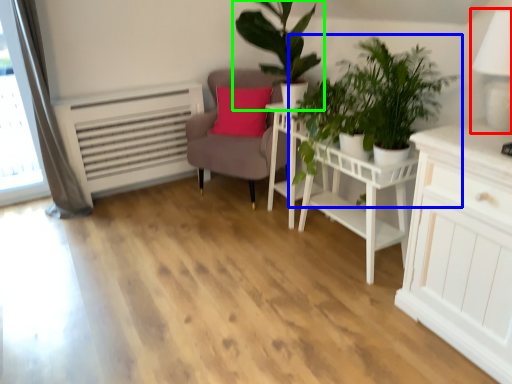
Question: Which is farther away from table lamp (highlighted by a red box)? houseplant (highlighted by a blue box) or houseplant (highlighted by a green box)?

Choices:
 (A) houseplant
 (B) houseplant

Answer: (B)